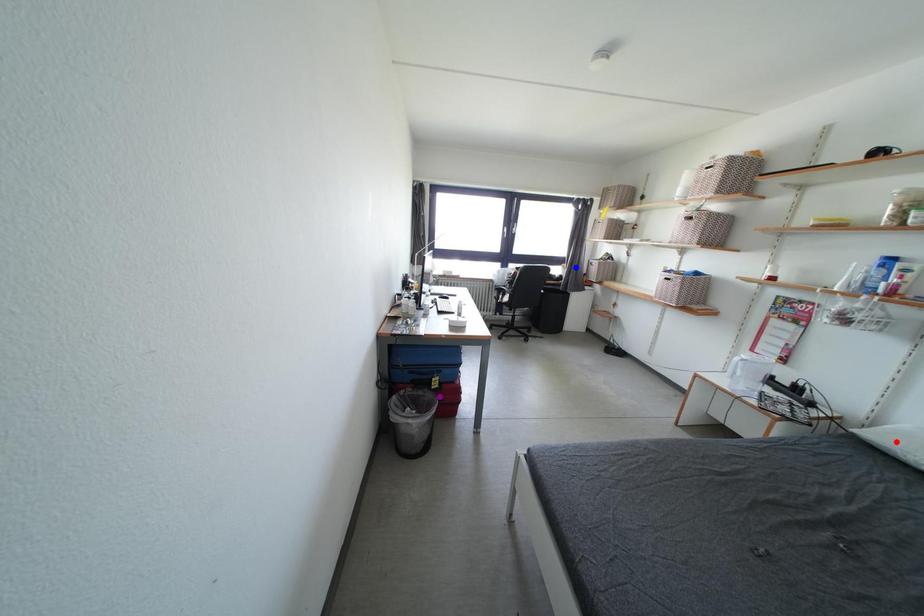
Order these from nearest to farthest:
A) red point
B) blue point
C) purple point

1. blue point
2. purple point
3. red point